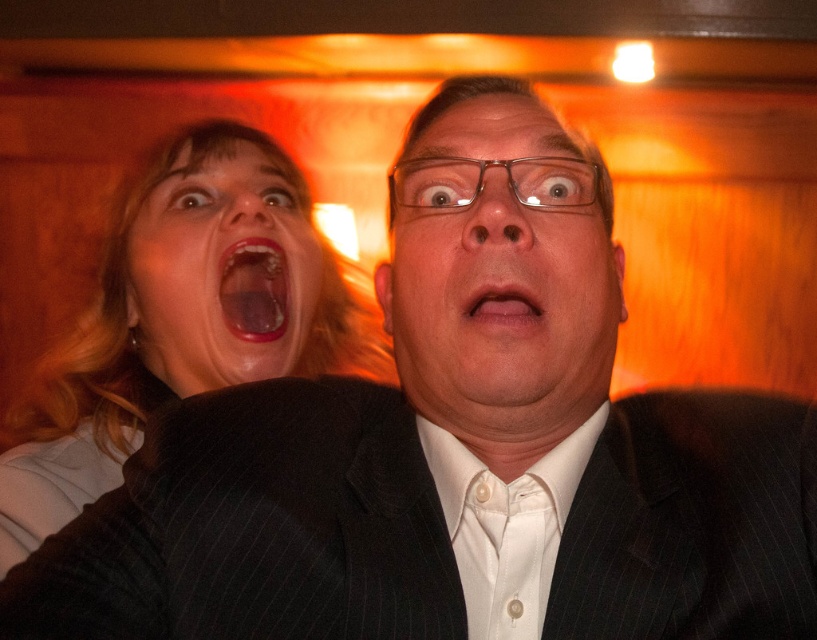
Which of these two, matte black jacket at left or white satin tie at center, stands taller?

matte black jacket at left

Can you confirm if matte black jacket at left is positioned above white satin tie at center?

Correct, matte black jacket at left is located above white satin tie at center.

Image resolution: width=817 pixels, height=640 pixels. What do you see at coordinates (176, 323) in the screenshot? I see `matte black jacket at left` at bounding box center [176, 323].

Identify the location of matte black jacket at left. (176, 323).

Between matte skin face at upper left and bright red glossy lips at center, which one has more height?

Standing taller between the two is matte skin face at upper left.

Is point (319, 284) less distant than point (271, 323)?

No, it is not.

In order to click on matte skin face at upper left in this screenshot , I will do `click(221, 272)`.

Which is above, matte black suit at center or pink matte lips at center?

matte black suit at center is higher up.

Consider the image. Does matte black suit at center appear on the right side of pink matte lips at center?

No, matte black suit at center is not to the right of pink matte lips at center.

What are the coordinates of `matte black suit at center` in the screenshot? It's located at (502, 301).

The width and height of the screenshot is (817, 640). What are the coordinates of `matte black suit at center` in the screenshot? It's located at (502, 301).